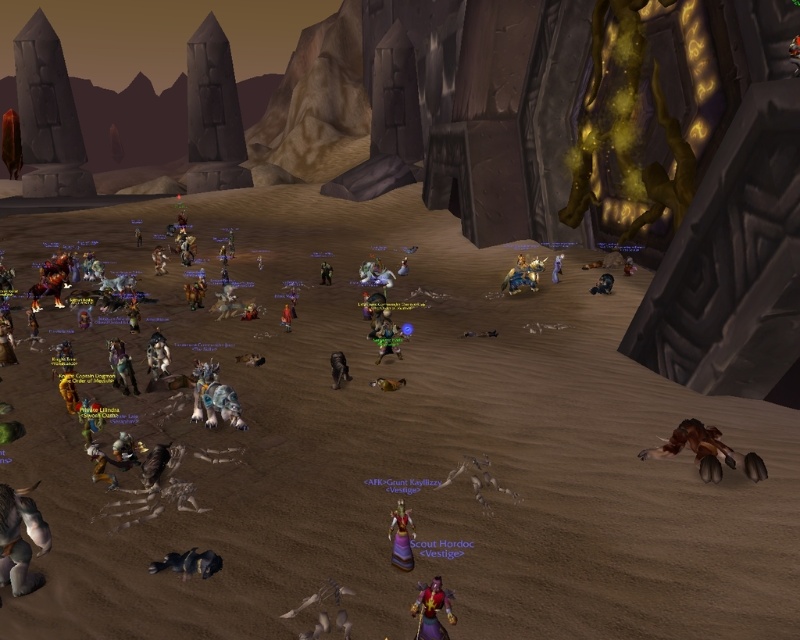
Between point (742, 468) and point (170, 552), which one is positioned in front?

Point (170, 552) is in front.

The image size is (800, 640). Describe the element at coordinates (708, 451) in the screenshot. I see `brown matte toy at lower right` at that location.

Describe the element at coordinates (708, 451) in the screenshot. The width and height of the screenshot is (800, 640). I see `brown matte toy at lower right` at that location.

Where is `brown matte toy at lower right`? brown matte toy at lower right is located at coordinates (708, 451).

Is brown matte toy at lower right positioned in front of green fabric doll at center?

Yes.

Which is below, brown matte toy at lower right or green fabric doll at center?

brown matte toy at lower right is below.

Between point (694, 448) and point (329, 284), which one is positioned in front?

Point (694, 448)

Find the location of a particular element. brown matte toy at lower right is located at coordinates (708, 451).

Can you confirm if gold metallic armor at center is wider than matte black toy at center?

Indeed, gold metallic armor at center has a greater width compared to matte black toy at center.

In the scene shown: Which is below, gold metallic armor at center or matte black toy at center?

Positioned lower is matte black toy at center.

What do you see at coordinates (522, 275) in the screenshot? I see `gold metallic armor at center` at bounding box center [522, 275].

Where is `gold metallic armor at center`? gold metallic armor at center is located at coordinates (522, 275).